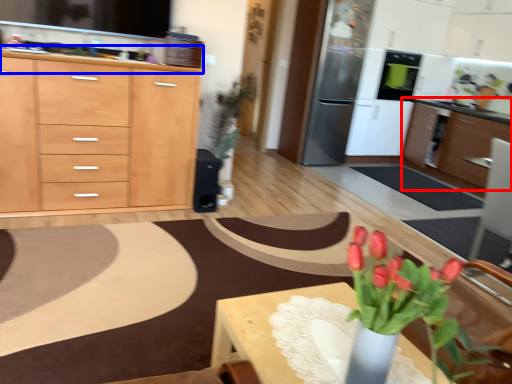
Question: Which object appears closest to the camera in this image, cabinetry (highlighted by a red box) or countertop (highlighted by a blue box)?

Choices:
 (A) cabinetry
 (B) countertop

Answer: (B)